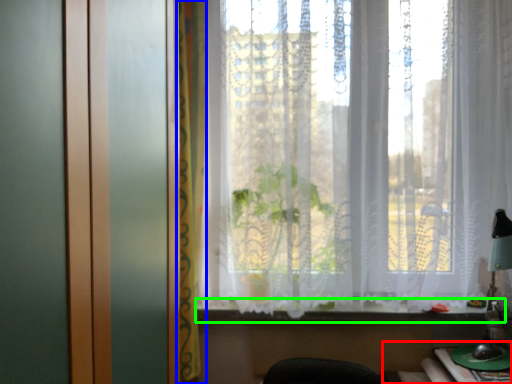
Question: Which object is positioned farthest from table (highlighted by a red box)? Select from curtain (highlighted by a blue box) and window sill (highlighted by a green box).

Choices:
 (A) curtain
 (B) window sill

Answer: (A)